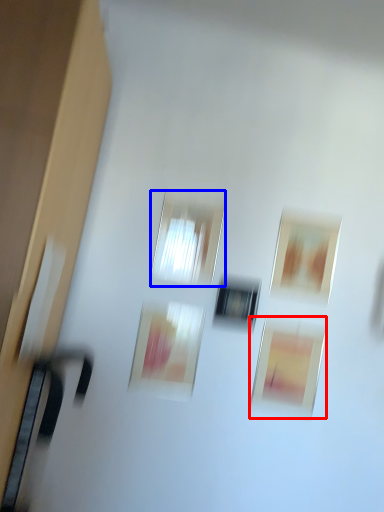
Question: Among these objects, which one is farthest to the camera, picture frame (highlighted by a red box) or window (highlighted by a blue box)?

Choices:
 (A) picture frame
 (B) window

Answer: (A)